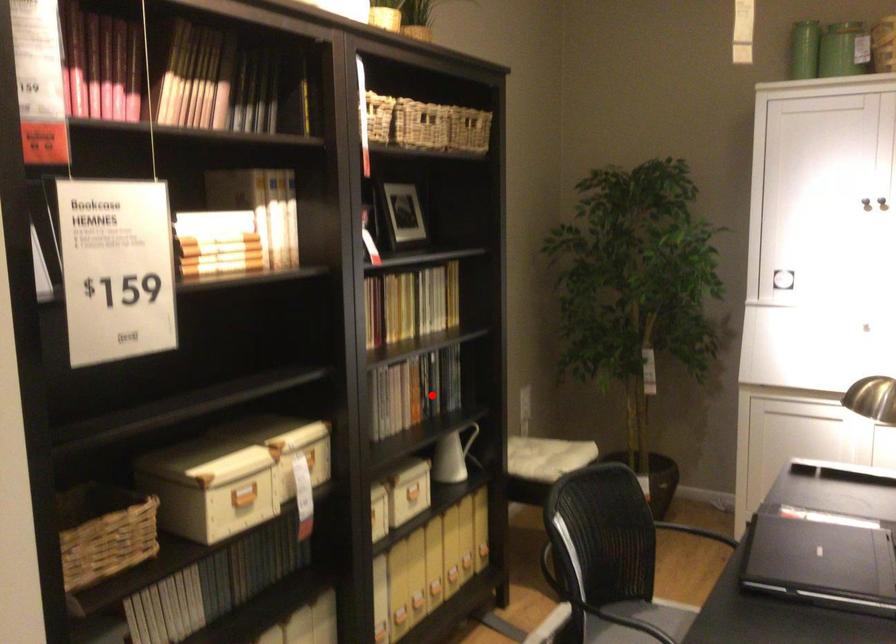
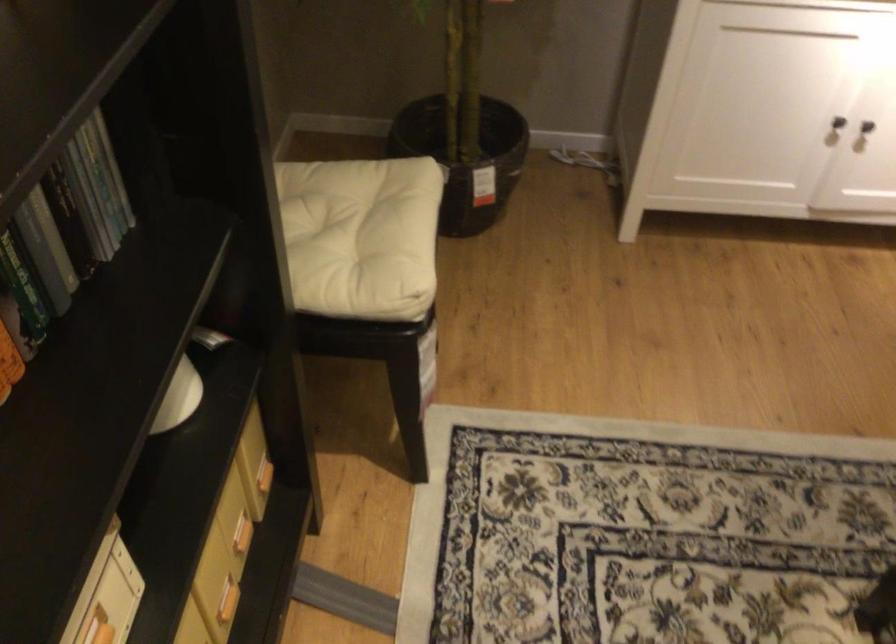
Question: I am providing you with two images of the same scene from different viewpoints. In image1, a red point is highlighted. Considering the same 3D point in image2, which of the following is correct?

Choices:
 (A) It is closer
 (B) It is farther

Answer: (A)